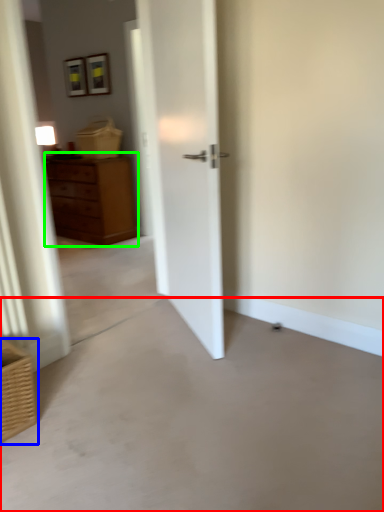
Question: Which object is the closest to the concrete (highlighted by a red box)? Choose among these: basket (highlighted by a blue box) or chest of drawers (highlighted by a green box).

Choices:
 (A) basket
 (B) chest of drawers

Answer: (A)